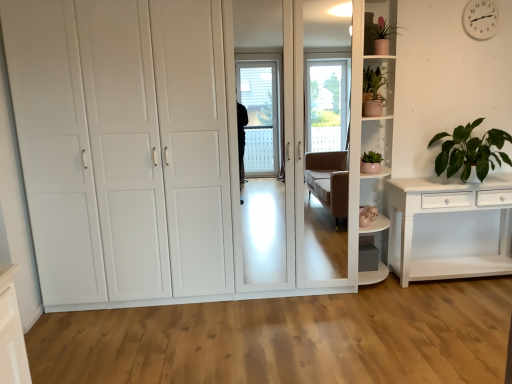
Question: Is green leafy plant at right, the 3th houseplant viewed from the left, situated inside green matte plant at upper right, the 2th houseplant positioned from the right, or outside?

Choices:
 (A) outside
 (B) inside

Answer: (A)

Question: From a real-world perspective, is green leafy plant at right, the 3th houseplant viewed from the left, positioned above or below green matte plant at upper right, the second houseplant when ordered from left to right?

Choices:
 (A) above
 (B) below

Answer: (B)

Question: Which of these objects is positioned farthest from the green leafy plant at right, the 3th houseplant viewed from the left?

Choices:
 (A) matte pink pot at upper right, acting as the 1th shelf starting from the top
 (B) green matte plant at upper right, the 2th houseplant positioned from the right
 (C) white glossy shelf at upper right, which is counted as the 2th shelf, starting from the top
 (D) matte pink pot at upper right, the 3th houseplant when ordered from right to left
 (E) white glossy cupboard at center

Answer: (E)

Question: Considering the real-world distances, which object is farthest from the matte pink pot at upper right, acting as the 1th houseplant starting from the left?

Choices:
 (A) white plastic clock at upper right
 (B) green leafy plant at right, marked as the first houseplant in a right-to-left arrangement
 (C) white glossy cupboard at center
 (D) white glossy shelf at upper right, which is counted as the 2th shelf, starting from the top
 (E) green matte plant at upper right, the second houseplant when ordered from left to right

Answer: (C)